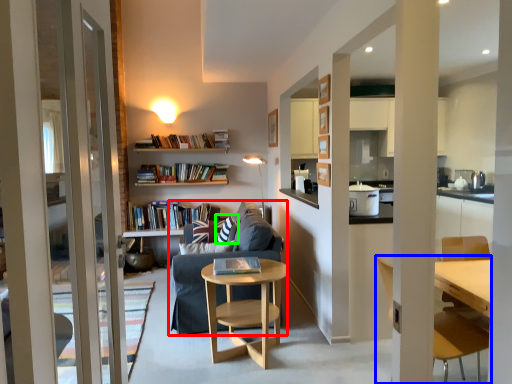
Question: Based on their relative distances, which object is nearer to studio couch (highlighted by a red box)? Choose from chair (highlighted by a blue box) and pillow (highlighted by a green box).

Choices:
 (A) chair
 (B) pillow

Answer: (B)